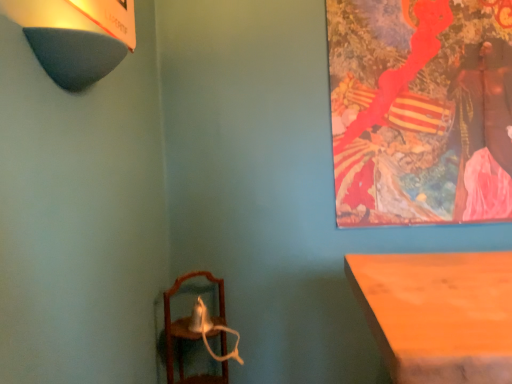
Where is `painted canvas at upper right`? painted canvas at upper right is located at coordinates (421, 110).

You are a GUI agent. You are given a task and a screenshot of the screen. Output one action in this format:
    pyautogui.click(x=<x>, y=<y>)
    Task: Click on the dark gray felt lampshade at upper left
    This screenshot has width=512, height=384.
    Given the screenshot: What is the action you would take?
    pyautogui.click(x=76, y=36)

The image size is (512, 384). What do you see at coordinates (76, 36) in the screenshot?
I see `dark gray felt lampshade at upper left` at bounding box center [76, 36].

Image resolution: width=512 pixels, height=384 pixels. Identify the location of painted canvas at upper right. pos(421,110).

Is dark gray felt lampshade at upper left at the back of painted canvas at upper right?

No, painted canvas at upper right is not facing away from dark gray felt lampshade at upper left.

Considering the sizes of objects painted canvas at upper right and dark gray felt lampshade at upper left in the image provided, who is thinner, painted canvas at upper right or dark gray felt lampshade at upper left?

With smaller width is painted canvas at upper right.

Is painted canvas at upper right located outside dark gray felt lampshade at upper left?

Absolutely, painted canvas at upper right is external to dark gray felt lampshade at upper left.

Which object is positioned more to the left, painted canvas at upper right or dark gray felt lampshade at upper left?

From the viewer's perspective, dark gray felt lampshade at upper left appears more on the left side.

Does point (55, 63) come farther from viewer compared to point (169, 375)?

No, (55, 63) is in front of (169, 375).

Can you confirm if dark gray felt lampshade at upper left is shorter than wooden mirror at lower left?

Yes, dark gray felt lampshade at upper left is shorter than wooden mirror at lower left.

Is dark gray felt lampshade at upper left touching wooden mirror at lower left?

There is a gap between dark gray felt lampshade at upper left and wooden mirror at lower left.

From a real-world perspective, does dark gray felt lampshade at upper left stand above wooden mirror at lower left?

Indeed, from a real-world perspective, dark gray felt lampshade at upper left stands above wooden mirror at lower left.

Is wooden mirror at lower left turned away from dark gray felt lampshade at upper left?

No.

Considering the relative sizes of wooden mirror at lower left and dark gray felt lampshade at upper left in the image provided, is wooden mirror at lower left bigger than dark gray felt lampshade at upper left?

Yes.

Where is `furniture behind the dark gray felt lampshade at upper left`? furniture behind the dark gray felt lampshade at upper left is located at coordinates (190, 333).

In the scene shown: Between wooden mirror at lower left and dark gray felt lampshade at upper left, which one has smaller width?

dark gray felt lampshade at upper left.

Are dark gray felt lampshade at upper left and painted canvas at upper right far apart?

Yes, dark gray felt lampshade at upper left is far from painted canvas at upper right.

Which object is positioned more to the left, dark gray felt lampshade at upper left or painted canvas at upper right?

Positioned to the left is dark gray felt lampshade at upper left.

From the picture: From the image's perspective, between dark gray felt lampshade at upper left and painted canvas at upper right, who is located below?

dark gray felt lampshade at upper left.

Would you say wooden mirror at lower left is to the left or to the right of painted canvas at upper right in the picture?

From the image, it's evident that wooden mirror at lower left is to the left of painted canvas at upper right.

Considering the sizes of objects wooden mirror at lower left and painted canvas at upper right in the image provided, who is wider, wooden mirror at lower left or painted canvas at upper right?

With larger width is wooden mirror at lower left.

From a real-world perspective, is wooden mirror at lower left located beneath painted canvas at upper right?

Correct, in the physical world, wooden mirror at lower left is lower than painted canvas at upper right.

Find the location of `picture frame that appears above the wooden mirror at lower left (from a real-world perspective)`. picture frame that appears above the wooden mirror at lower left (from a real-world perspective) is located at coordinates (421, 110).

Is painted canvas at upper right inside the boundaries of wooden mirror at lower left, or outside?

painted canvas at upper right is outside wooden mirror at lower left.

Is painted canvas at upper right bigger than wooden mirror at lower left?

Actually, painted canvas at upper right might be smaller than wooden mirror at lower left.

From the image's perspective, relative to wooden mirror at lower left, is painted canvas at upper right above or below?

Based on their image positions, painted canvas at upper right is located above wooden mirror at lower left.

Consider the image. How far apart are painted canvas at upper right and wooden mirror at lower left?

painted canvas at upper right is 3.39 feet away from wooden mirror at lower left.

Locate an element on the screen. picture frame located underneath the dark gray felt lampshade at upper left (from a real-world perspective) is located at coordinates (421, 110).

Locate an element on the screen. This screenshot has width=512, height=384. furniture that appears below the dark gray felt lampshade at upper left (from the image's perspective) is located at coordinates (190, 333).

Estimate the real-world distances between objects in this image. Which object is closer to dark gray felt lampshade at upper left, painted canvas at upper right or wooden mirror at lower left?

wooden mirror at lower left lies closer to dark gray felt lampshade at upper left than the other object.

Estimate the real-world distances between objects in this image. Which object is closer to wooden mirror at lower left, dark gray felt lampshade at upper left or painted canvas at upper right?

Based on the image, painted canvas at upper right appears to be nearer to wooden mirror at lower left.

Based on the photo, when comparing their distances from painted canvas at upper right, does dark gray felt lampshade at upper left or wooden mirror at lower left seem closer?

The object closer to painted canvas at upper right is wooden mirror at lower left.

Looking at this image, estimate the real-world distances between objects in this image. Which object is closer to painted canvas at upper right, wooden mirror at lower left or dark gray felt lampshade at upper left?

Among the two, wooden mirror at lower left is located nearer to painted canvas at upper right.

From the image, which object appears to be nearer to dark gray felt lampshade at upper left, wooden mirror at lower left or painted canvas at upper right?

Among the two, wooden mirror at lower left is located nearer to dark gray felt lampshade at upper left.

When comparing their distances from wooden mirror at lower left, does painted canvas at upper right or dark gray felt lampshade at upper left seem further?

Based on the image, dark gray felt lampshade at upper left appears to be further to wooden mirror at lower left.

This screenshot has width=512, height=384. Find the location of `furniture between dark gray felt lampshade at upper left and painted canvas at upper right in the horizontal direction`. furniture between dark gray felt lampshade at upper left and painted canvas at upper right in the horizontal direction is located at coordinates (190, 333).